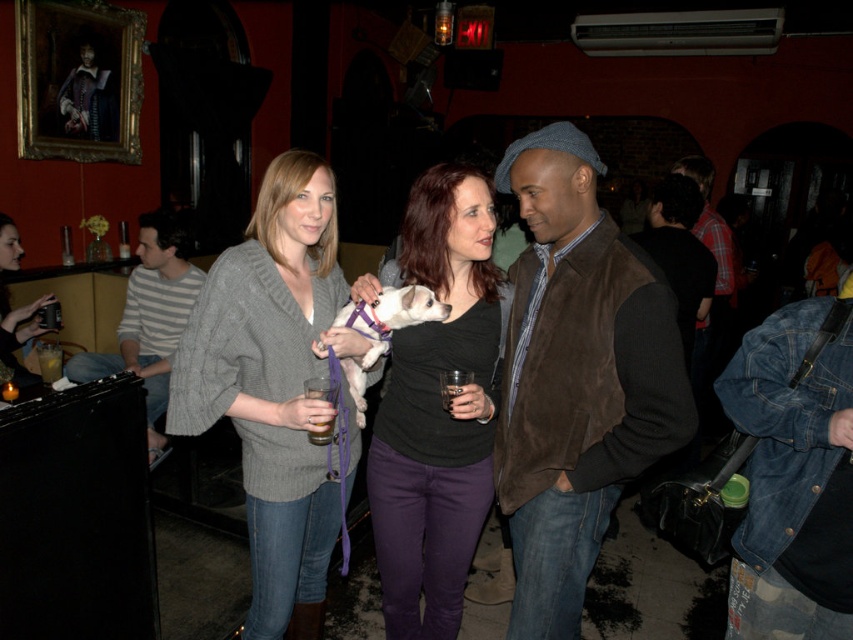
You are at a party and want to place a small note on the table between the knitted gray sweater at center and the translucent glass at bar left. Which object should you place the note closer to so it doesn

The knitted gray sweater at center is taller than the translucent glass at bar left, so placing the note closer to the knitted gray sweater at center would ensure it is more visible.

You are taking a photo of the scene and want to focus on both point (26, 316) and point (45, 368). Which point should you focus on first to ensure both are in sharp focus?

You should focus on point (26, 316) first because it is closer to the camera than point (45, 368). This way, both points will be within the depth of field and in sharp focus.